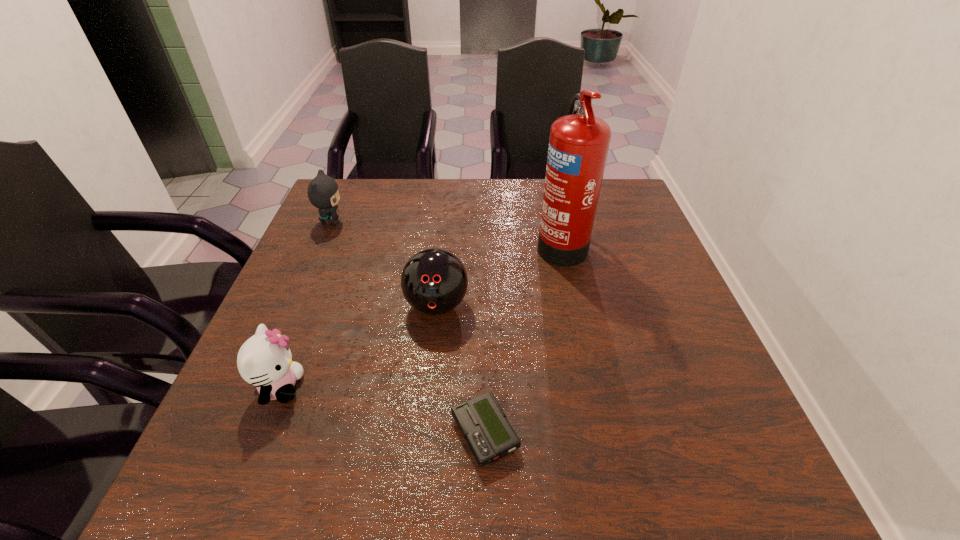
The height and width of the screenshot is (540, 960). I want to click on unoccupied position between the bowling ball and the farther kitten, so click(x=384, y=264).

Locate an element on the screen. free space that is in between the rightmost object and the bowling ball is located at coordinates (498, 274).

Where is `blank region between the nearer kitten and the rightmost object`? blank region between the nearer kitten and the rightmost object is located at coordinates (420, 315).

Select which object is the second closest to the tallest object. Please provide its 2D coordinates. Your answer should be formatted as a tuple, i.e. [(x, y)], where the tuple contains the x and y coordinates of a point satisfying the conditions above.

[(482, 422)]

Select which object is the fourth closest to the nearer kitten. Please provide its 2D coordinates. Your answer should be formatted as a tuple, i.e. [(x, y)], where the tuple contains the x and y coordinates of a point satisfying the conditions above.

[(578, 146)]

This screenshot has width=960, height=540. I want to click on free space in the image that satisfies the following two spatial constraints: 1. on the front-facing side of the farther kitten; 2. on the left side of the shortest object, so click(x=240, y=434).

Find the location of a particular element. free space that satisfies the following two spatial constraints: 1. on the front-facing side of the beeper; 2. on the left side of the nearer kitten is located at coordinates (261, 434).

I want to click on vacant area that satisfies the following two spatial constraints: 1. on the surface of the bowling ball near the finger holes; 2. on the front-facing side of the nearer kitten, so click(x=428, y=387).

The width and height of the screenshot is (960, 540). In order to click on vacant space that satisfies the following two spatial constraints: 1. on the back side of the beeper; 2. on the front-facing side of the farther kitten in this screenshot , I will do `click(483, 221)`.

The width and height of the screenshot is (960, 540). What are the coordinates of `vacant region that satisfies the following two spatial constraints: 1. on the front-facing side of the nearer kitten; 2. on the back side of the shortest object` in the screenshot? It's located at (261, 434).